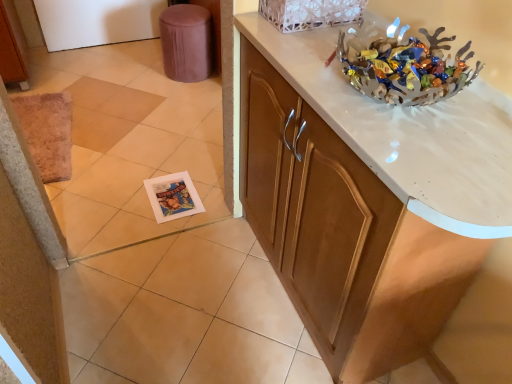
Question: Is white lace basket at upper center wider than brown fabric stool at upper left?

Choices:
 (A) no
 (B) yes

Answer: (A)

Question: Is white lace basket at upper center behind brown fabric stool at upper left?

Choices:
 (A) no
 (B) yes

Answer: (A)

Question: Is white lace basket at upper center facing away from brown fabric stool at upper left?

Choices:
 (A) yes
 (B) no

Answer: (B)

Question: Is white lace basket at upper center oriented towards brown fabric stool at upper left?

Choices:
 (A) no
 (B) yes

Answer: (A)

Question: Is white lace basket at upper center in contact with brown fabric stool at upper left?

Choices:
 (A) no
 (B) yes

Answer: (A)

Question: Is white lace basket at upper center surrounding brown fabric stool at upper left?

Choices:
 (A) no
 (B) yes

Answer: (A)

Question: From a real-world perspective, is white lace basket at upper center on top of white marble countertop at upper right?

Choices:
 (A) yes
 (B) no

Answer: (A)

Question: Is white lace basket at upper center at the left side of white marble countertop at upper right?

Choices:
 (A) yes
 (B) no

Answer: (A)

Question: Is white lace basket at upper center next to white marble countertop at upper right and touching it?

Choices:
 (A) no
 (B) yes

Answer: (A)

Question: Does white lace basket at upper center turn towards white marble countertop at upper right?

Choices:
 (A) yes
 (B) no

Answer: (B)

Question: Is white lace basket at upper center at the right side of white marble countertop at upper right?

Choices:
 (A) no
 (B) yes

Answer: (A)

Question: Does white lace basket at upper center have a greater height compared to white marble countertop at upper right?

Choices:
 (A) yes
 (B) no

Answer: (B)

Question: Is white lace basket at upper center next to metallic silver bowl at upper right?

Choices:
 (A) no
 (B) yes

Answer: (A)